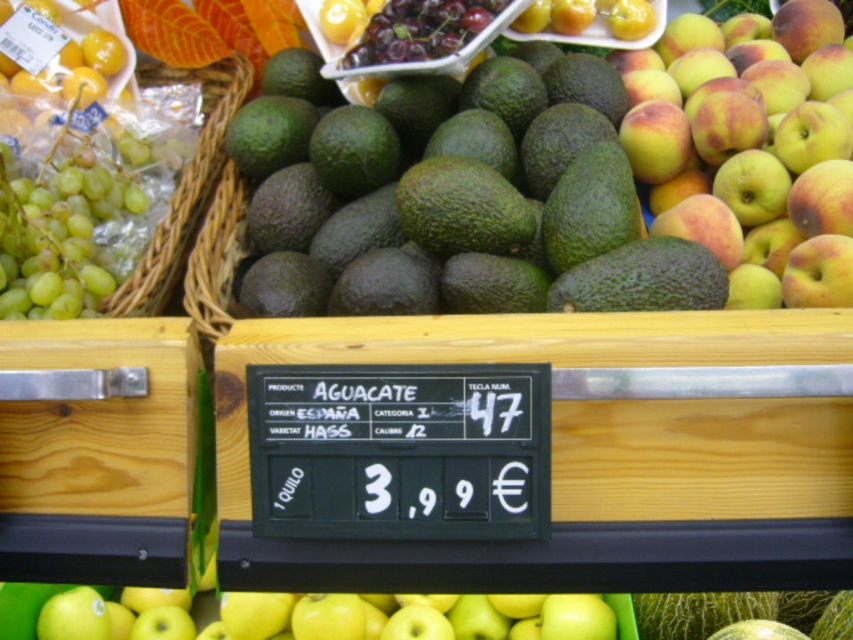
Is yellow matte apple at center thinner than green woven basket at left?

No.

Who is positioned more to the left, yellow matte apple at center or green woven basket at left?

green woven basket at left

Measure the distance between yellow matte apple at center and camera.

yellow matte apple at center and camera are 3.81 feet apart.

The image size is (853, 640). Find the location of `yellow matte apple at center`. yellow matte apple at center is located at coordinates (751, 147).

Does green matte avocado at center appear on the left side of green woven basket at left?

Incorrect, green matte avocado at center is not on the left side of green woven basket at left.

Consider the image. Which is below, green matte avocado at center or green woven basket at left?

Positioned lower is green matte avocado at center.

At what (x,y) coordinates should I click in order to perform the action: click on green matte avocado at center. Please return your answer as a coordinate pair (x, y). This screenshot has width=853, height=640. Looking at the image, I should click on (451, 198).

Locate an element on the screen. green matte avocado at center is located at coordinates coord(451,198).

Is point (103, 272) positioned before point (154, 230)?

Yes, it is.

Does green matte grapes at left have a lesser width compared to green woven basket at left?

Correct, green matte grapes at left's width is less than green woven basket at left's.

Find the location of a particular element. green matte grapes at left is located at coordinates (61, 230).